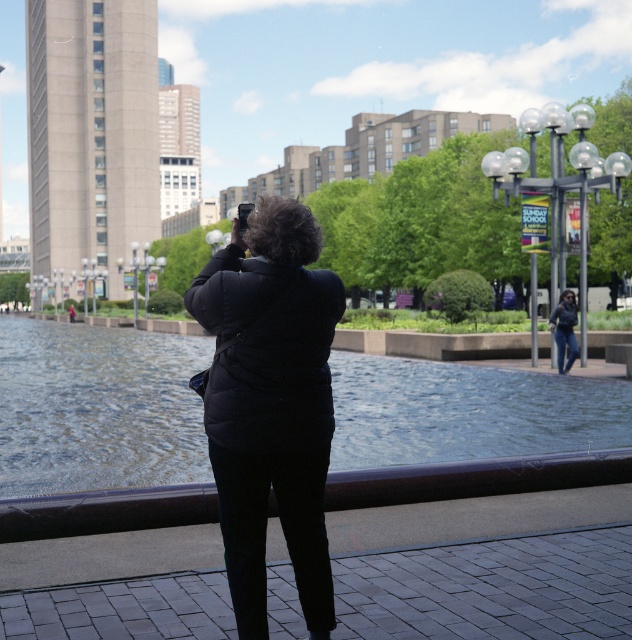
Does point (210, 310) come farther from viewer compared to point (559, 333)?

No, it is not.

Which is above, black matte jacket at center or denim jacket at center?

denim jacket at center is above.

Where is `black matte jacket at center`? This screenshot has height=640, width=632. black matte jacket at center is located at coordinates (270, 403).

At what (x,y) coordinates should I click in order to perform the action: click on blue glassy water at center. Please return your answer as a coordinate pair (x, y). This screenshot has height=640, width=632. Looking at the image, I should click on (97, 406).

What do you see at coordinates (97, 406) in the screenshot? I see `blue glassy water at center` at bounding box center [97, 406].

Does point (112, 458) lie in front of point (307, 300)?

That is False.

Find the location of a particular element. Image resolution: width=632 pixels, height=640 pixels. blue glassy water at center is located at coordinates (97, 406).

Does blue glassy water at center appear on the left side of denim jacket at center?

Correct, you'll find blue glassy water at center to the left of denim jacket at center.

Image resolution: width=632 pixels, height=640 pixels. What do you see at coordinates (97, 406) in the screenshot?
I see `blue glassy water at center` at bounding box center [97, 406].

Is point (557, 420) positioned in front of point (574, 353)?

That is True.

Locate an element on the screen. This screenshot has height=640, width=632. blue glassy water at center is located at coordinates (97, 406).